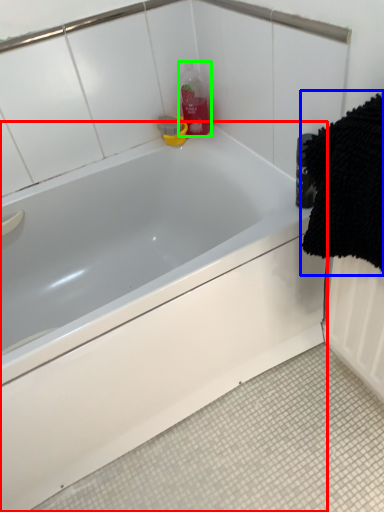
Question: Which is nearer to the bathtub (highlighted by a red box)? bath towel (highlighted by a blue box) or cleaning product (highlighted by a green box).

Choices:
 (A) bath towel
 (B) cleaning product

Answer: (A)